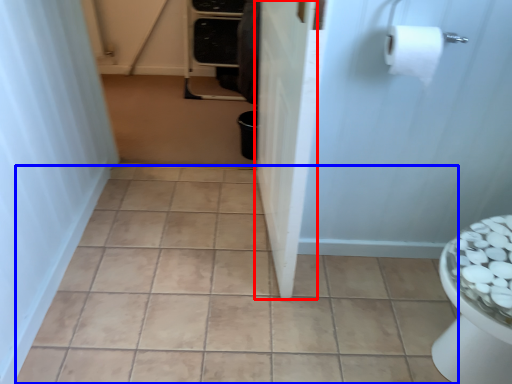
Question: Among these objects, which one is farthest to the camera, screen door (highlighted by a red box) or ceramic tile (highlighted by a blue box)?

Choices:
 (A) screen door
 (B) ceramic tile

Answer: (B)